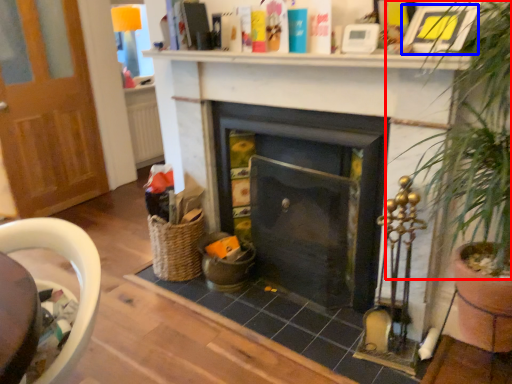
Question: Which object is closer to the camera taking this photo, plant (highlighted by a red box) or picture frame (highlighted by a blue box)?

Choices:
 (A) plant
 (B) picture frame

Answer: (A)